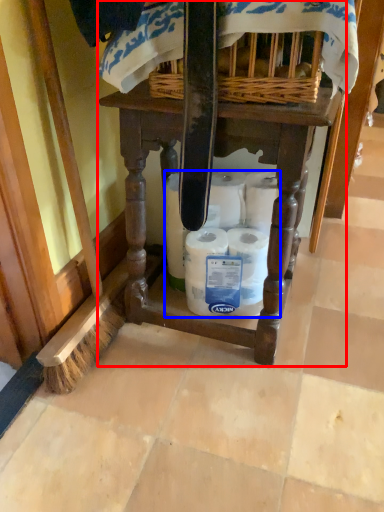
Question: Which point is further to the camera, furniture (highlighted by a red box) or toilet paper (highlighted by a blue box)?

Choices:
 (A) furniture
 (B) toilet paper

Answer: (B)